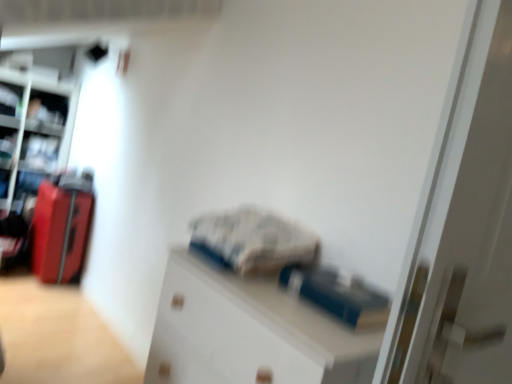
What is the approximate width of matte black shelf at upper left?

It is 9.39 inches.

The image size is (512, 384). What do you see at coordinates (47, 108) in the screenshot? I see `matte black shelf at upper left` at bounding box center [47, 108].

Describe the element at coordinates (249, 332) in the screenshot. I see `white matte cabinet at center` at that location.

The width and height of the screenshot is (512, 384). Describe the element at coordinates (462, 226) in the screenshot. I see `white glossy door at center` at that location.

Locate an element on the screen. matte black shelf at upper left is located at coordinates (47, 108).

Is matte red suitcase at left at the left side of white matte cabinet at center?

Correct, you'll find matte red suitcase at left to the left of white matte cabinet at center.

From the image's perspective, relative to white matte cabinet at center, is matte red suitcase at left above or below?

matte red suitcase at left is above white matte cabinet at center.

Is matte red suitcase at left aimed at white matte cabinet at center?

No, matte red suitcase at left is not facing towards white matte cabinet at center.

In order to click on cabinetry in front of the matte red suitcase at left in this screenshot , I will do `click(249, 332)`.

From the image's perspective, is matte red suitcase at left located above or below metallic silver bookshelf at left?

From the image's perspective, matte red suitcase at left appears below metallic silver bookshelf at left.

Is matte red suitcase at left to the left of metallic silver bookshelf at left from the viewer's perspective?

No.

Is matte red suitcase at left taller or shorter than metallic silver bookshelf at left?

In the image, matte red suitcase at left appears to be shorter than metallic silver bookshelf at left.

Can you confirm if matte red suitcase at left is wider than metallic silver bookshelf at left?

No.

Considering the sizes of metallic silver bookshelf at left and white matte cabinet at center in the image, is metallic silver bookshelf at left wider or thinner than white matte cabinet at center?

Considering their sizes, metallic silver bookshelf at left looks broader than white matte cabinet at center.

Considering the sizes of metallic silver bookshelf at left and white matte cabinet at center in the image, is metallic silver bookshelf at left taller or shorter than white matte cabinet at center?

Clearly, metallic silver bookshelf at left is taller compared to white matte cabinet at center.

Is metallic silver bookshelf at left in contact with white matte cabinet at center?

No, metallic silver bookshelf at left is not next to white matte cabinet at center.

From the image's perspective, who appears lower, metallic silver bookshelf at left or white matte cabinet at center?

white matte cabinet at center.

Is metallic silver bookshelf at left positioned in front of white glossy door at center?

No, metallic silver bookshelf at left is further to the viewer.

From their relative heights in the image, would you say metallic silver bookshelf at left is taller or shorter than white glossy door at center?

Clearly, metallic silver bookshelf at left is taller compared to white glossy door at center.

Is there a large distance between metallic silver bookshelf at left and white glossy door at center?

That's right, there is a large distance between metallic silver bookshelf at left and white glossy door at center.

From a real-world perspective, is metallic silver bookshelf at left physically below matte red suitcase at left?

Actually, metallic silver bookshelf at left is physically above matte red suitcase at left in the real world.

Looking at the image, does metallic silver bookshelf at left seem bigger or smaller compared to matte red suitcase at left?

In the image, metallic silver bookshelf at left appears to be larger than matte red suitcase at left.

At what (x,y) coordinates should I click in order to perform the action: click on luggage on the right of metallic silver bookshelf at left. Please return your answer as a coordinate pair (x, y). Image resolution: width=512 pixels, height=384 pixels. Looking at the image, I should click on (61, 227).

From the image's perspective, between metallic silver bookshelf at left and matte red suitcase at left, who is located below?

matte red suitcase at left appears lower in the image.

Can you confirm if matte black shelf at upper left is taller than matte red suitcase at left?

No, matte black shelf at upper left is not taller than matte red suitcase at left.

Could you tell me if matte black shelf at upper left is turned towards matte red suitcase at left?

No, matte black shelf at upper left is not turned towards matte red suitcase at left.

Can you tell me how much matte black shelf at upper left and matte red suitcase at left differ in facing direction?

The angular difference between matte black shelf at upper left and matte red suitcase at left is 82.2 degrees.

Which point is more forward, (54, 99) or (35, 173)?

Point (35, 173)

Is matte black shelf at upper left oriented away from metallic silver bookshelf at left?

Yes.

From the picture: Is matte black shelf at upper left in front of or behind metallic silver bookshelf at left in the image?

Clearly, matte black shelf at upper left is behind metallic silver bookshelf at left.

Between matte black shelf at upper left and metallic silver bookshelf at left, which one has larger size?

With larger size is metallic silver bookshelf at left.

In the image, there is a white matte cabinet at center. Where is `luggage below it (from a real-world perspective)`? The width and height of the screenshot is (512, 384). luggage below it (from a real-world perspective) is located at coordinates (61, 227).

You are a GUI agent. You are given a task and a screenshot of the screen. Output one action in this format:
    pyautogui.click(x=<x>, y=<y>)
    Task: Click on the luggage in front of the metallic silver bookshelf at left
    The width and height of the screenshot is (512, 384).
    Given the screenshot: What is the action you would take?
    pyautogui.click(x=61, y=227)

Consider the image. When comparing their distances from matte red suitcase at left, does metallic silver bookshelf at left or matte black shelf at upper left seem closer?

The object closer to matte red suitcase at left is metallic silver bookshelf at left.

When comparing their distances from white matte cabinet at center, does matte red suitcase at left or white glossy door at center seem closer?

→ white glossy door at center.

From the image, which object appears to be farther from matte red suitcase at left, matte black shelf at upper left or metallic silver bookshelf at left?

The object further to matte red suitcase at left is matte black shelf at upper left.

When comparing their distances from metallic silver bookshelf at left, does white glossy door at center or white matte cabinet at center seem further?

white glossy door at center lies further to metallic silver bookshelf at left than the other object.

Looking at the image, which one is located closer to white matte cabinet at center, matte black shelf at upper left or white glossy door at center?

white glossy door at center.

When comparing their distances from matte black shelf at upper left, does white matte cabinet at center or white glossy door at center seem further?

Based on the image, white glossy door at center appears to be further to matte black shelf at upper left.

When comparing their distances from matte red suitcase at left, does matte black shelf at upper left or white matte cabinet at center seem further?

white matte cabinet at center is further to matte red suitcase at left.

From the image, which object appears to be farther from metallic silver bookshelf at left, white glossy door at center or matte red suitcase at left?

The object further to metallic silver bookshelf at left is white glossy door at center.

Locate an element on the screen. Image resolution: width=512 pixels, height=384 pixels. bookshelf between matte black shelf at upper left and matte red suitcase at left in the up-down direction is located at coordinates 30,145.

At what (x,y) coordinates should I click in order to perform the action: click on cabinetry between white glossy door at center and metallic silver bookshelf at left along the z-axis. Please return your answer as a coordinate pair (x, y). This screenshot has height=384, width=512. Looking at the image, I should click on (249, 332).

Find the location of `luggage between white glossy door at center and matte black shelf at upper left in the front-back direction`. luggage between white glossy door at center and matte black shelf at upper left in the front-back direction is located at coordinates (61, 227).

Image resolution: width=512 pixels, height=384 pixels. What are the coordinates of `bookshelf between white matte cabinet at center and matte black shelf at upper left along the z-axis` in the screenshot? It's located at (30, 145).